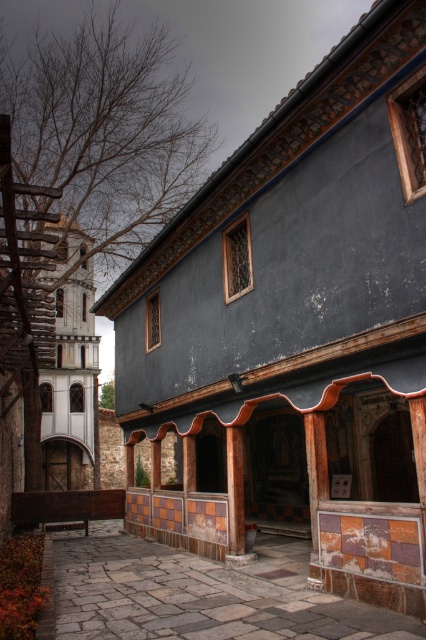
Which is above, rustic stone courtyard at center or brown wood pillar at center?

Positioned higher is brown wood pillar at center.

Between rustic stone courtyard at center and brown wood pillar at center, which one appears on the left side from the viewer's perspective?

rustic stone courtyard at center

Is point (201, 593) more distant than point (238, 509)?

No, (201, 593) is in front of (238, 509).

In order to click on rustic stone courtyard at center in this screenshot , I will do pyautogui.click(x=201, y=593).